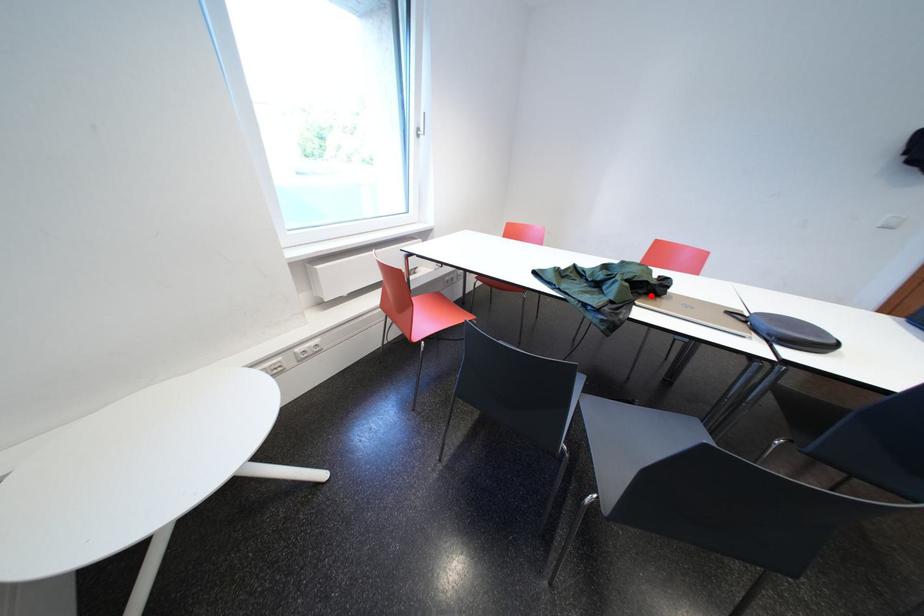
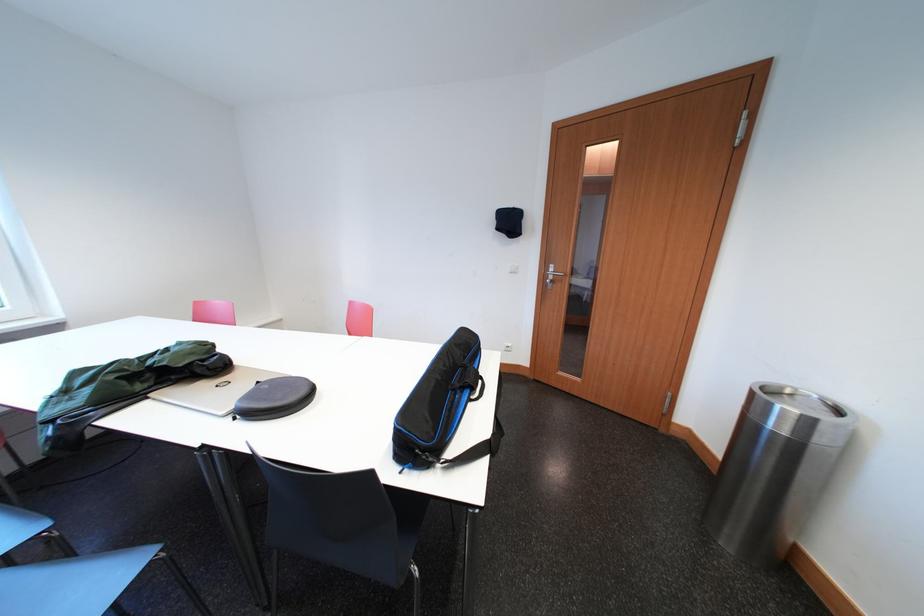
In the second image, find the point that corresponds to the highlighted location in the first image.

(181, 382)